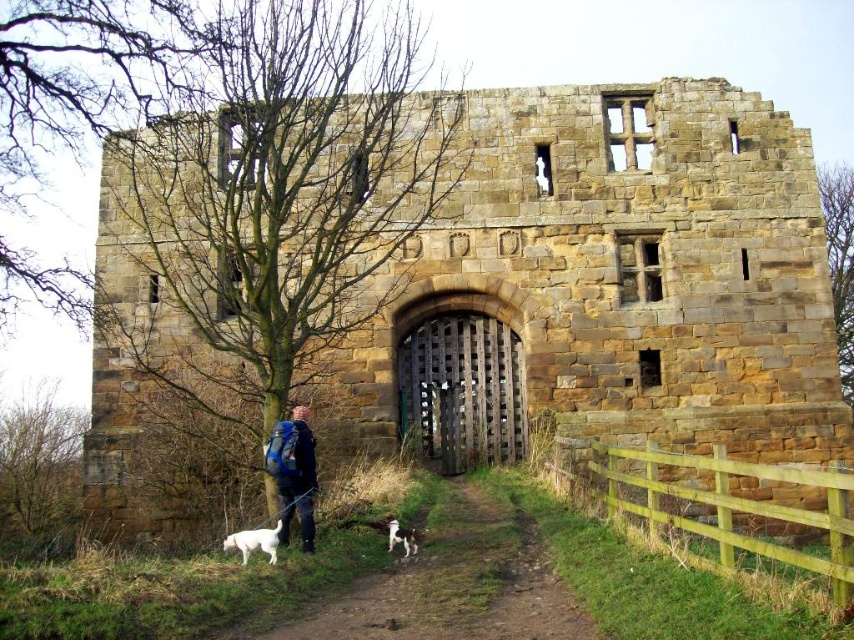
Does wooden gate at center have a greater width compared to white fur dog at lower left?

Correct, the width of wooden gate at center exceeds that of white fur dog at lower left.

What do you see at coordinates (461, 390) in the screenshot?
I see `wooden gate at center` at bounding box center [461, 390].

Image resolution: width=854 pixels, height=640 pixels. I want to click on wooden gate at center, so click(461, 390).

Does white fur dog at lower left have a lesser width compared to white fur dog at lower center?

Incorrect, white fur dog at lower left's width is not less than white fur dog at lower center's.

Can you confirm if white fur dog at lower left is shorter than white fur dog at lower center?

In fact, white fur dog at lower left may be taller than white fur dog at lower center.

Locate an element on the screen. The image size is (854, 640). white fur dog at lower left is located at coordinates pos(254,541).

Is brown dirt path at lower center positioned in front of blue backpack at lower left?

Yes, brown dirt path at lower center is closer to the viewer.

Does brown dirt path at lower center appear under blue backpack at lower left?

Yes.

Is point (434, 508) positioned behind point (291, 451)?

Yes, point (434, 508) is farther from viewer.

Find the location of a particular element. Image resolution: width=854 pixels, height=640 pixels. brown dirt path at lower center is located at coordinates (455, 582).